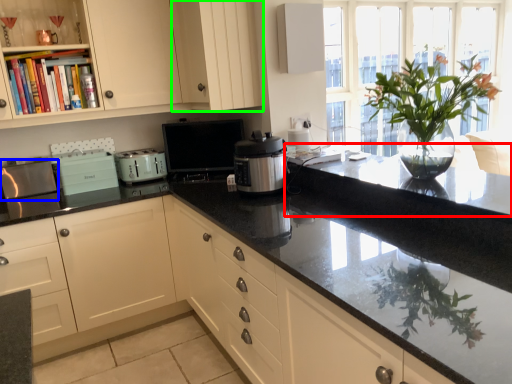
Question: Considering the real-world distances, which object is farthest from countertop (highlighted by a red box)? appliance (highlighted by a blue box) or cabinetry (highlighted by a green box)?

Choices:
 (A) appliance
 (B) cabinetry

Answer: (A)